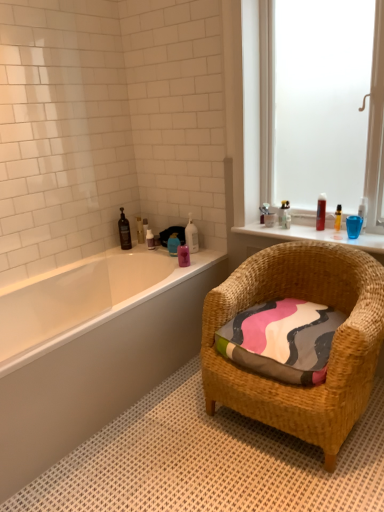
The height and width of the screenshot is (512, 384). I want to click on vacant space in front of clear plastic bottle at upper right, which is the ninth toiletry in left-to-right order, so click(289, 229).